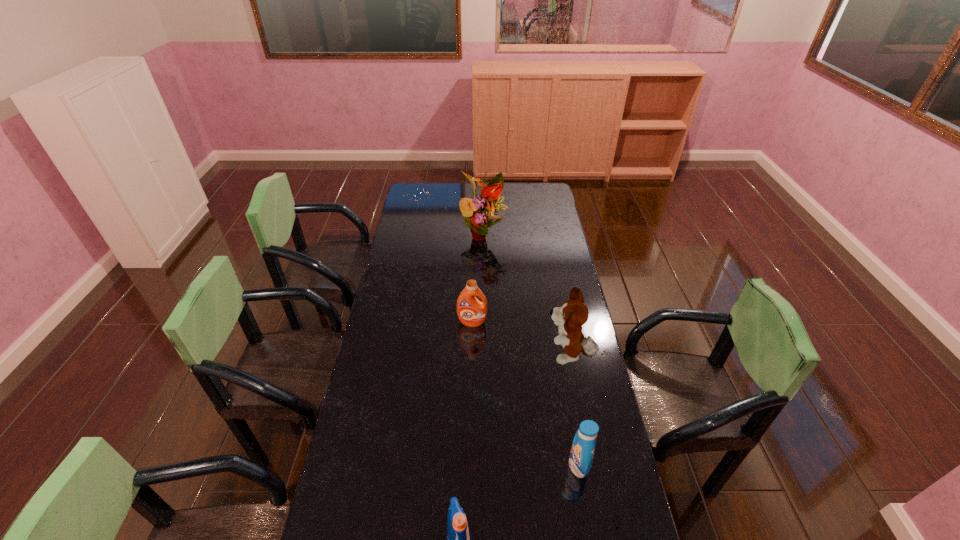
This screenshot has height=540, width=960. I want to click on vacant space located 0.070m on the front-facing side of the fourth nearest object, so (472, 340).

This screenshot has width=960, height=540. In order to click on vacant space located on the front-facing side of the second nearest detergent in this screenshot , I will do `click(484, 465)`.

At what (x,y) coordinates should I click in order to perform the action: click on free spot located on the front-facing side of the second nearest detergent. Please return your answer as a coordinate pair (x, y). The image size is (960, 540). Looking at the image, I should click on (497, 465).

Where is `vacant space located on the front-facing side of the second nearest detergent`? vacant space located on the front-facing side of the second nearest detergent is located at coordinates (455, 465).

In order to click on puppy located at the right edge in this screenshot , I will do `click(570, 317)`.

The width and height of the screenshot is (960, 540). What are the coordinates of `detergent that is at the right edge` in the screenshot? It's located at (582, 451).

The image size is (960, 540). What are the coordinates of `vacant space at the left edge of the desktop` in the screenshot? It's located at (411, 284).

This screenshot has width=960, height=540. In the image, there is a desktop. In order to click on vacant region at the far left corner in this screenshot , I will do `click(417, 204)`.

This screenshot has width=960, height=540. In order to click on blank space at the far right corner of the desktop in this screenshot , I will do pyautogui.click(x=534, y=198).

Identify the location of empty location between the second nearest object and the fourth nearest object. (525, 394).